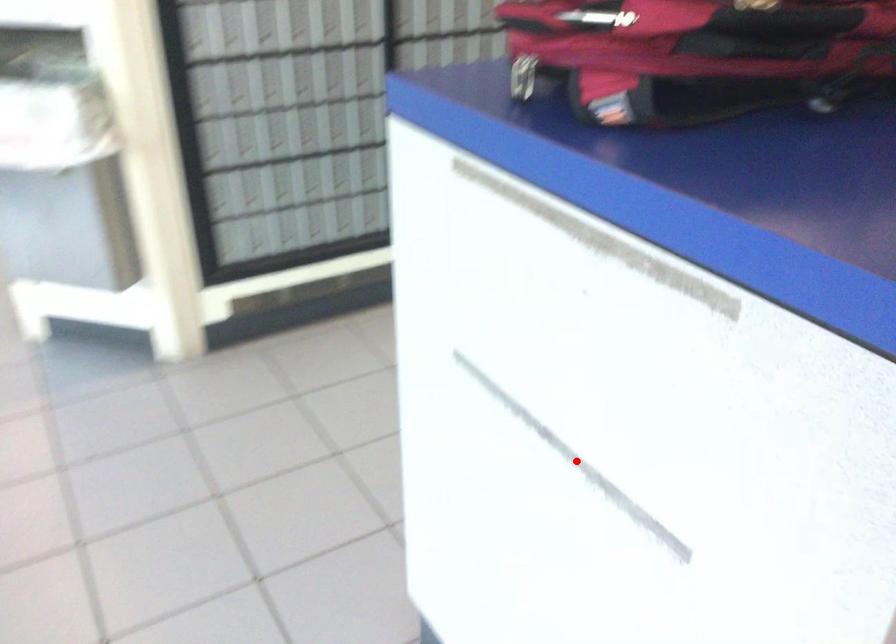
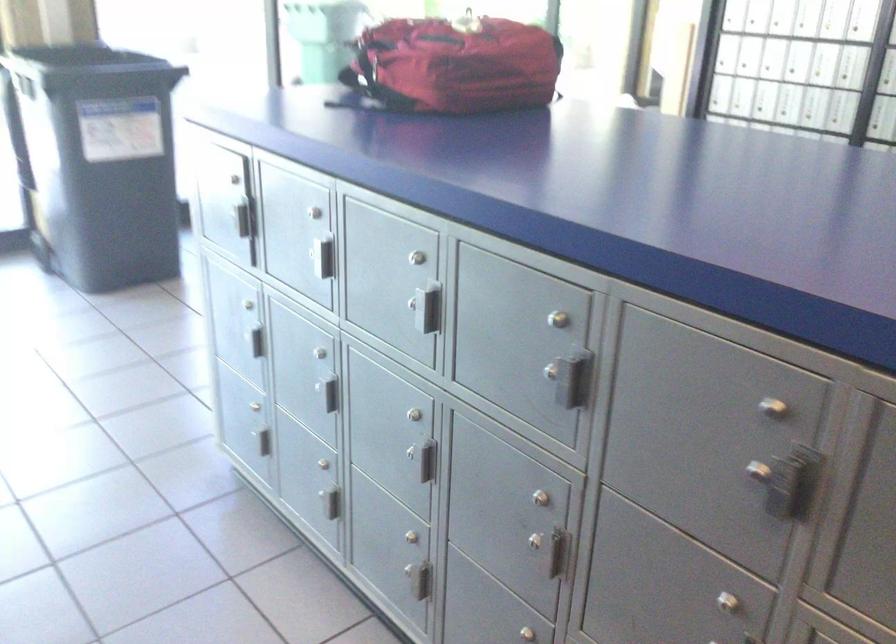
Question: I am providing you with two images of the same scene from different viewpoints. A red point is marked on the first image. Is the red point's position out of view in image 2?

Choices:
 (A) Yes
 (B) No

Answer: (A)